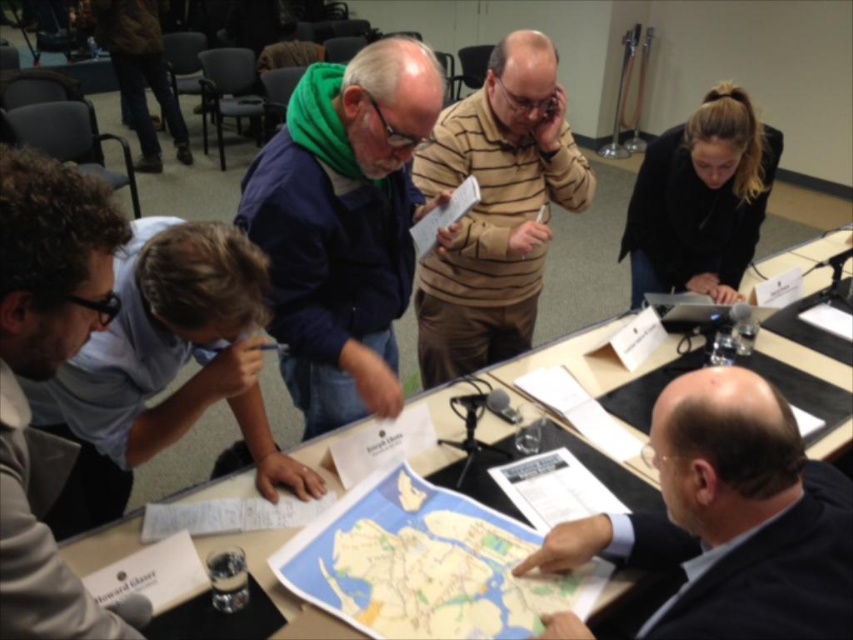
Based on the coordinates provided, which object is located at point (164,368) in the scene?

The point (164,368) corresponds to the blue shirt at lower left.

From the picture: You are attending a meeting in a conference room and need to find a place to sit. There are two people visible in the scene, one wearing a blue shirt at lower left and another in a black matte jacket at upper right. Which of these two individuals is sitting closer to the table?

Answer: The blue shirt at lower left is larger in size than the black matte jacket at upper right, but the description does not provide information about their proximity to the table. Therefore, I cannot determine which individual is sitting closer based on the given details.

Consider the image. You are a guest arriving at the conference room and need to sit down. There is a dark suit jacket at lower right and a black plastic table at center. Which object should you avoid placing your coffee cup on to respect personal belongings?

You should avoid placing your coffee cup on the dark suit jacket at lower right to respect personal belongings, as it belongs to someone and is placed there intentionally.